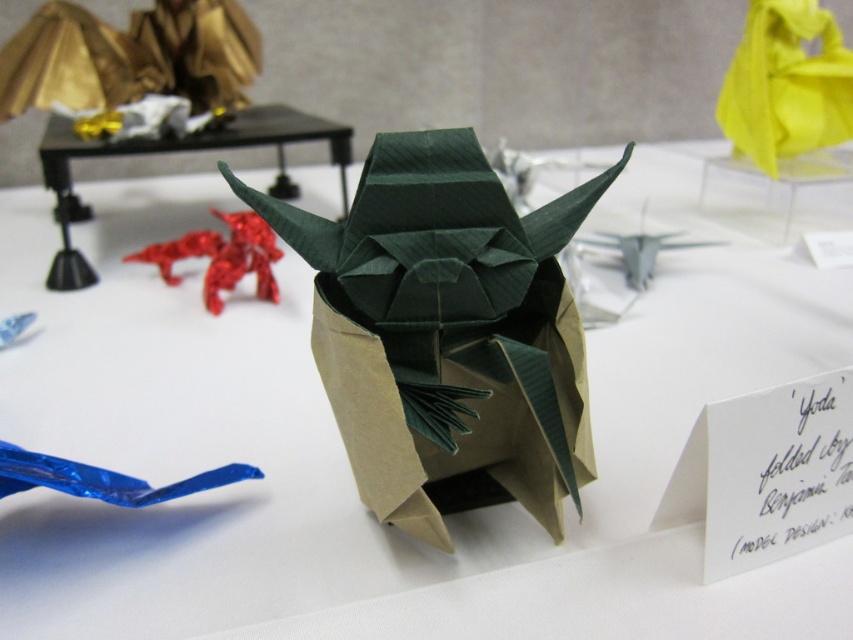
You are an artist preparing to display your origami creations. You have a yellow paper bag at upper right and a white paper at center. Which object should you choose if you need a larger surface area to place a small decoration?

The yellow paper bag at upper right is larger in size than the white paper at center, so you should choose the yellow paper bag at upper right for placing the small decoration.

You are an artist standing at the edge of the white surface where the origami models are displayed. You notice a point marked at coordinates (177, 150). Which object is located at that point?

The point at coordinates (177, 150) is on the black plastic table at upper center.